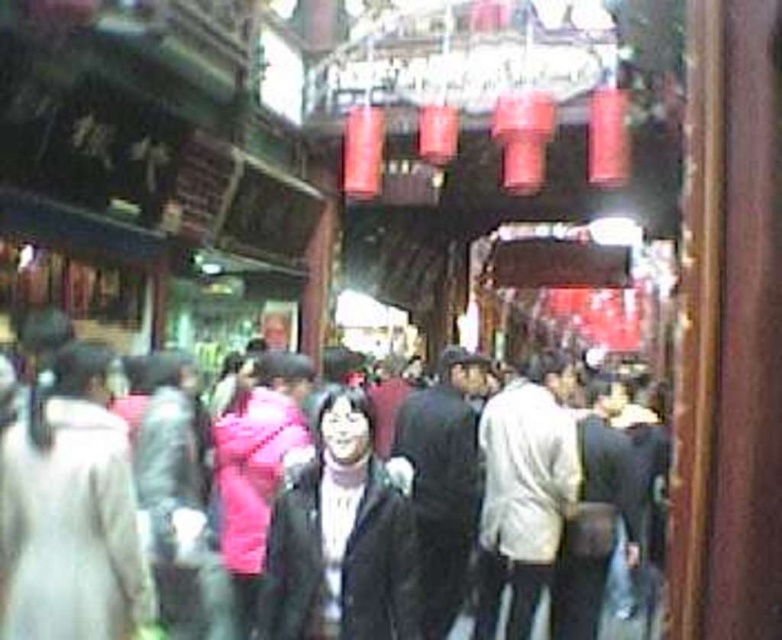
Question: Does black matte jacket at center appear under dark gray jacket at center?

Choices:
 (A) yes
 (B) no

Answer: (B)

Question: Is black matte jacket at center positioned in front of dark gray jacket at center?

Choices:
 (A) no
 (B) yes

Answer: (B)

Question: Does black matte jacket at center appear on the left side of dark gray jacket at center?

Choices:
 (A) no
 (B) yes

Answer: (B)

Question: Which point is closer to the camera?

Choices:
 (A) (38, 340)
 (B) (307, 634)

Answer: (B)